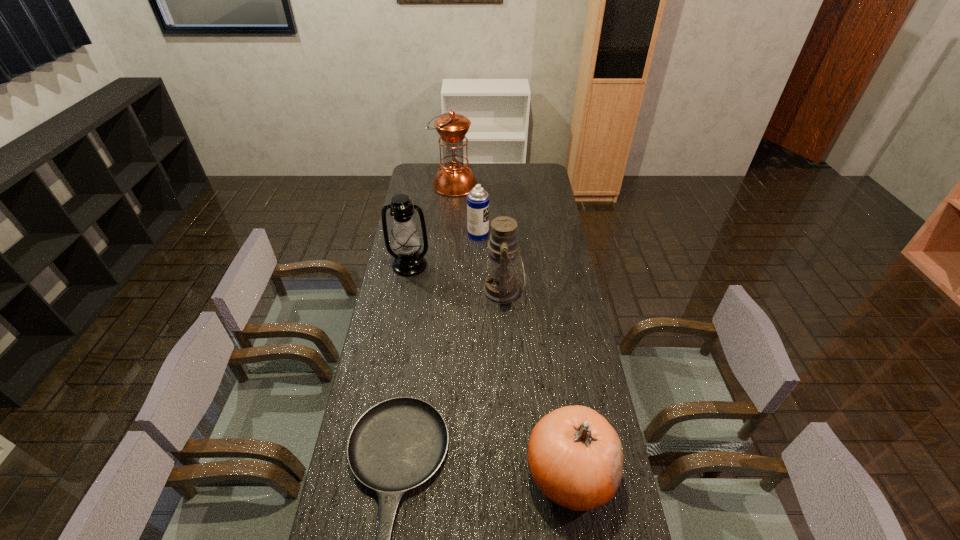
Where is `oil lamp identified as the third closest to the frying pan`? oil lamp identified as the third closest to the frying pan is located at coordinates (454, 179).

Identify which oil lamp is the third closest to the shortest object. Please provide its 2D coordinates. Your answer should be formatted as a tuple, i.e. [(x, y)], where the tuple contains the x and y coordinates of a point satisfying the conditions above.

[(454, 179)]

Locate an element on the screen. The height and width of the screenshot is (540, 960). vacant space that satisfies the following two spatial constraints: 1. on the front side of the pumpkin; 2. on the right side of the rightmost oil lamp is located at coordinates (514, 472).

This screenshot has width=960, height=540. Find the location of `vacant space that satisfies the following two spatial constraints: 1. on the label side of the aerosol can; 2. on the right side of the pumpkin`. vacant space that satisfies the following two spatial constraints: 1. on the label side of the aerosol can; 2. on the right side of the pumpkin is located at coordinates (477, 472).

At what (x,y) coordinates should I click in order to perform the action: click on free location that satisfies the following two spatial constraints: 1. on the label side of the aerosol can; 2. on the right side of the pumpkin. Please return your answer as a coordinate pair (x, y). Looking at the image, I should click on (477, 472).